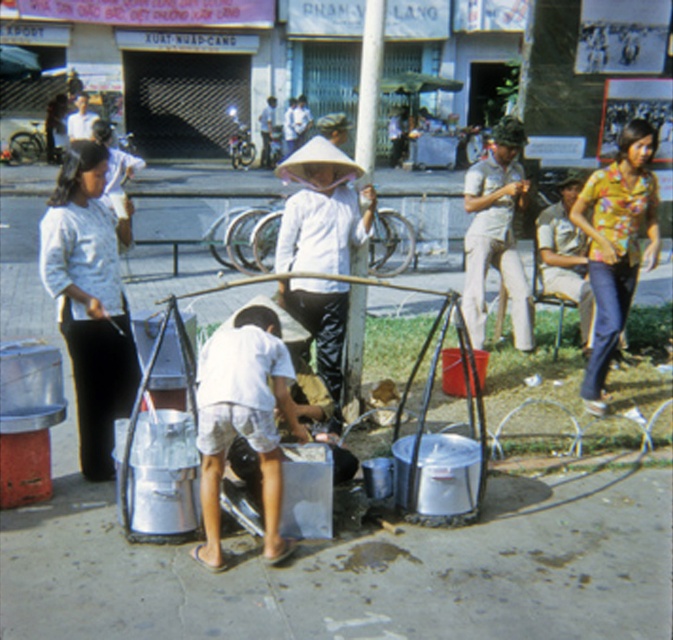
Question: Considering the relative positions of white cotton shirt at left and floral yellow shirt at right in the image provided, where is white cotton shirt at left located with respect to floral yellow shirt at right?

Choices:
 (A) above
 (B) below

Answer: (B)

Question: Is white cotton shirt at left above floral yellow shirt at right?

Choices:
 (A) yes
 (B) no

Answer: (B)

Question: Is floral yellow shirt at right thinner than light beige uniform at center?

Choices:
 (A) no
 (B) yes

Answer: (A)

Question: Based on their relative distances, which object is farther from the light beige uniform at center?

Choices:
 (A) floral yellow shirt at right
 (B) white cotton shirt at left

Answer: (B)

Question: Which object is positioned closest to the floral yellow shirt at right?

Choices:
 (A) light beige uniform at center
 (B) white cotton shirt at left

Answer: (A)

Question: Which point is farther to the camera?

Choices:
 (A) (639, 147)
 (B) (52, 272)

Answer: (A)